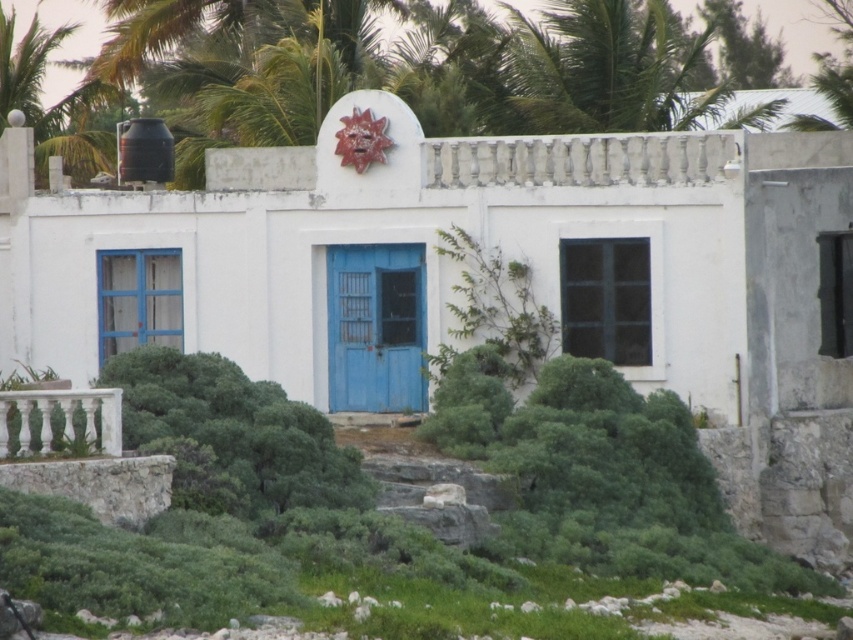
Question: Is green leafy bush at center positioned behind blue painted wood door at left?

Choices:
 (A) yes
 (B) no

Answer: (B)

Question: Which point is farther from the camera taking this photo?

Choices:
 (A) (331, 412)
 (B) (323, 461)
 (C) (123, 260)

Answer: (C)

Question: Considering the real-world distances, which object is farthest from the blue painted wood door at left?

Choices:
 (A) green leafy bush at center
 (B) blue matte door at center

Answer: (A)

Question: Is green leafy bush at center smaller than blue matte door at center?

Choices:
 (A) no
 (B) yes

Answer: (A)

Question: Which point appears farthest from the camera in this image?

Choices:
 (A) (389, 362)
 (B) (291, 438)

Answer: (A)

Question: Does blue matte door at center have a larger size compared to blue painted wood door at left?

Choices:
 (A) yes
 (B) no

Answer: (A)